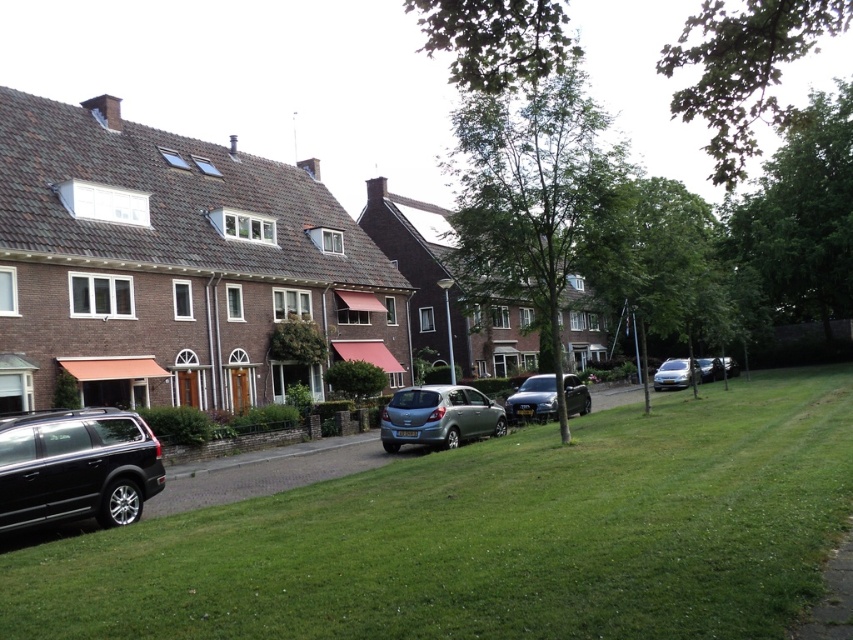
You are standing on the sidewalk and want to walk to the satin silver hatchback at center. Which direction should you walk to reach it from the green grass lawn at lower center?

Since the green grass lawn at lower center is above the satin silver hatchback at center, you should walk downward towards the satin silver hatchback at center.